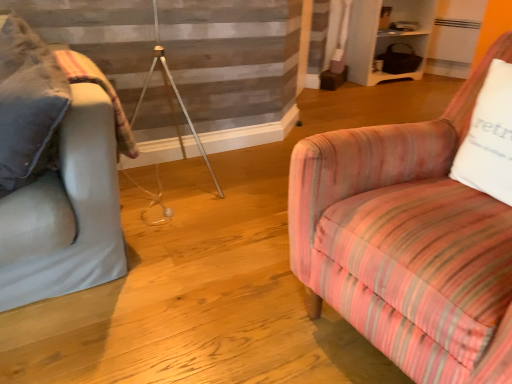
Question: From the image's perspective, is pink striped fabric chair at right under light gray fabric couch at left?

Choices:
 (A) no
 (B) yes

Answer: (B)

Question: From a real-world perspective, does pink striped fabric chair at right sit lower than light gray fabric couch at left?

Choices:
 (A) no
 (B) yes

Answer: (B)

Question: Is pink striped fabric chair at right to the left of light gray fabric couch at left from the viewer's perspective?

Choices:
 (A) yes
 (B) no

Answer: (B)

Question: Are pink striped fabric chair at right and light gray fabric couch at left making contact?

Choices:
 (A) no
 (B) yes

Answer: (A)

Question: Can you confirm if pink striped fabric chair at right is thinner than light gray fabric couch at left?

Choices:
 (A) yes
 (B) no

Answer: (B)

Question: Is pink striped fabric chair at right facing away from light gray fabric couch at left?

Choices:
 (A) yes
 (B) no

Answer: (B)

Question: Can you see plush beige blanket at left touching light gray fabric couch at left?

Choices:
 (A) no
 (B) yes

Answer: (A)

Question: Is there a large distance between plush beige blanket at left and light gray fabric couch at left?

Choices:
 (A) yes
 (B) no

Answer: (B)

Question: Does plush beige blanket at left turn towards light gray fabric couch at left?

Choices:
 (A) no
 (B) yes

Answer: (A)

Question: Considering the relative sizes of plush beige blanket at left and light gray fabric couch at left in the image provided, is plush beige blanket at left bigger than light gray fabric couch at left?

Choices:
 (A) yes
 (B) no

Answer: (B)

Question: Is light gray fabric couch at left located within plush beige blanket at left?

Choices:
 (A) yes
 (B) no

Answer: (B)

Question: Does plush beige blanket at left have a lesser width compared to light gray fabric couch at left?

Choices:
 (A) no
 (B) yes

Answer: (B)

Question: Does light gray fabric couch at left have a greater height compared to white cotton pillow at right?

Choices:
 (A) no
 (B) yes

Answer: (B)